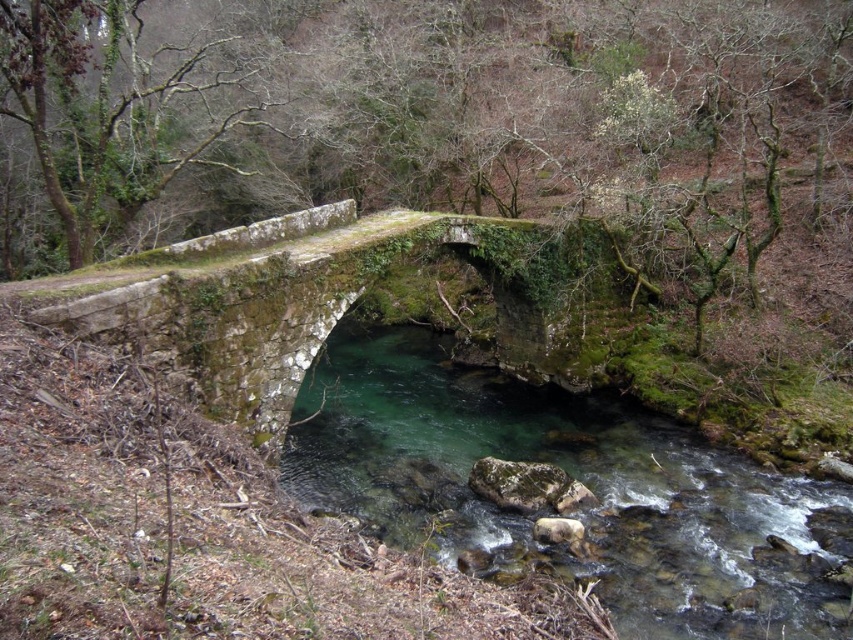
Between green stone river at center and green mossy stone bridge at center, which one is positioned lower?

green stone river at center is below.

Can you confirm if green stone river at center is positioned to the left of green mossy stone bridge at center?

No, green stone river at center is not to the left of green mossy stone bridge at center.

The width and height of the screenshot is (853, 640). Find the location of `green stone river at center`. green stone river at center is located at coordinates (573, 476).